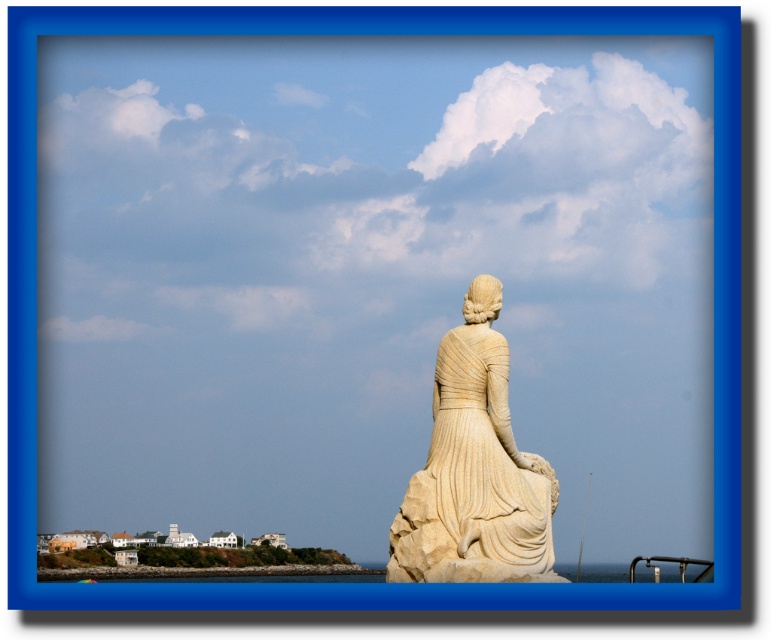
Question: Which object is farther from the camera taking this photo?

Choices:
 (A) clear blue water at lower center
 (B) white marble statue at center

Answer: (A)

Question: Which point is closer to the camera?

Choices:
 (A) (541, 524)
 (B) (581, 573)

Answer: (A)

Question: Is white marble statue at center wider than clear blue water at lower center?

Choices:
 (A) no
 (B) yes

Answer: (A)

Question: Is white marble statue at center below clear blue water at lower center?

Choices:
 (A) yes
 (B) no

Answer: (B)

Question: Is white marble statue at center positioned at the back of clear blue water at lower center?

Choices:
 (A) yes
 (B) no

Answer: (B)